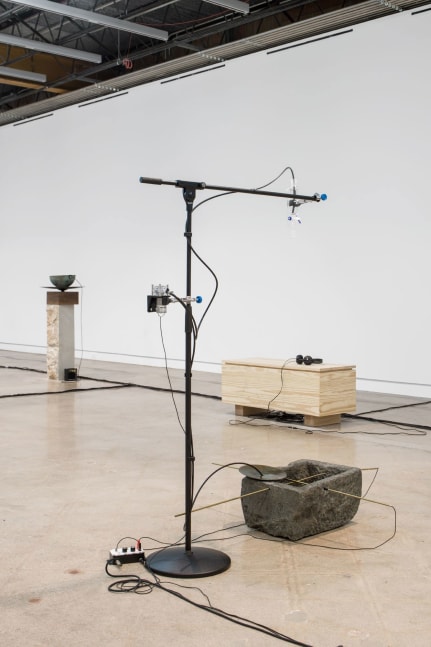
This screenshot has width=431, height=647. In order to click on floor stains in this screenshot , I will do `click(73, 571)`, `click(35, 600)`.